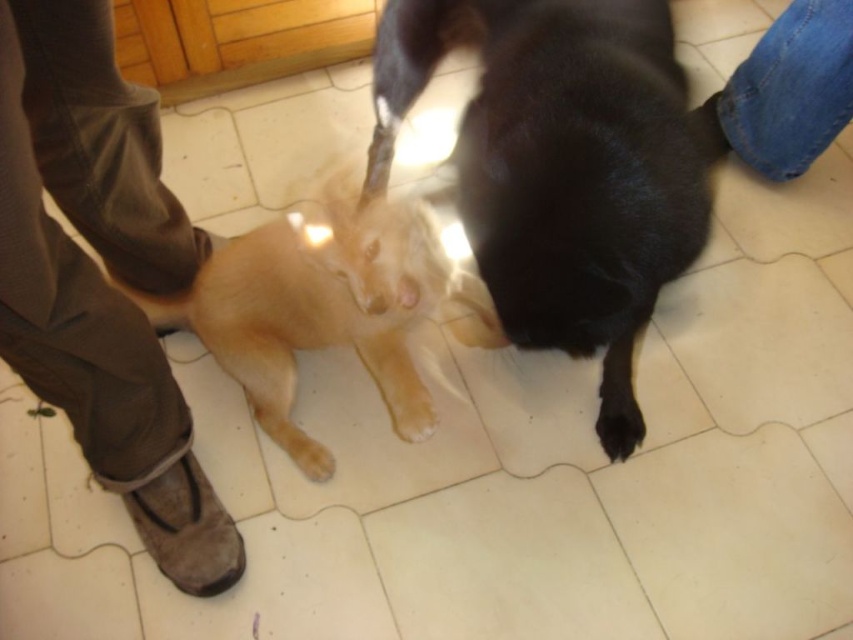
You are a robotic vacuum cleaner with a width of 30 cm. You are currently in the room with the black fur dog at center and the brown suede shoe at lower left. Can you navigate between them without hitting either?

The black fur dog at center is wider than the brown suede shoe at lower left. Since the robotic vacuum cleaner is 30 cm wide, it depends on the actual width of the dog. If the dog is wider than 30 cm, there might not be enough space. However, without specific measurements, we can only state the relative size.

You are a pet owner who wants to buy a new pet bed for both dogs. The bed you found can accommodate a maximum width of 50 cm. If the black fur dog at center is narrower than the golden fur dog at center, can both dogs fit on the bed at the same time?

The black fur dog at center is narrower than the golden fur dog at center. However, without knowing the exact widths of both dogs, it is impossible to determine if their combined width exceeds the bed capacity. Please measure both dogs to ensure they fit.